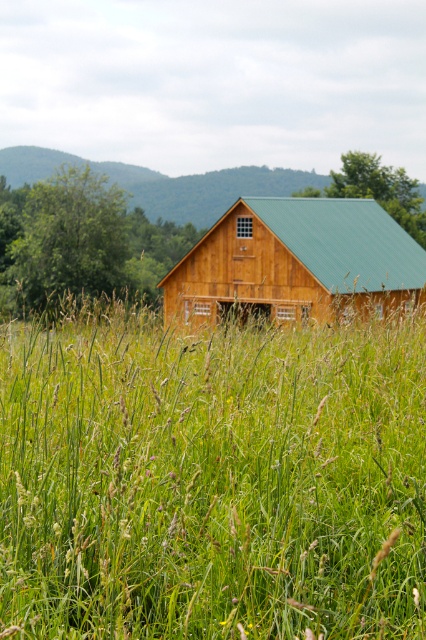
Question: Considering the relative positions of green grass at center and wooden barn at center in the image provided, where is green grass at center located with respect to wooden barn at center?

Choices:
 (A) above
 (B) below

Answer: (B)

Question: Considering the relative positions of green grass at center and wooden barn at center in the image provided, where is green grass at center located with respect to wooden barn at center?

Choices:
 (A) below
 (B) above

Answer: (A)

Question: Which point is farther from the camera taking this photo?

Choices:
 (A) (333, 232)
 (B) (273, 460)

Answer: (A)

Question: Which point is farther to the camera?

Choices:
 (A) wooden barn at center
 (B) green grass at center

Answer: (A)

Question: Is green grass at center further to the viewer compared to wooden barn at center?

Choices:
 (A) yes
 (B) no

Answer: (B)

Question: Which object is closer to the camera taking this photo?

Choices:
 (A) wooden barn at center
 (B) green grass at center

Answer: (B)